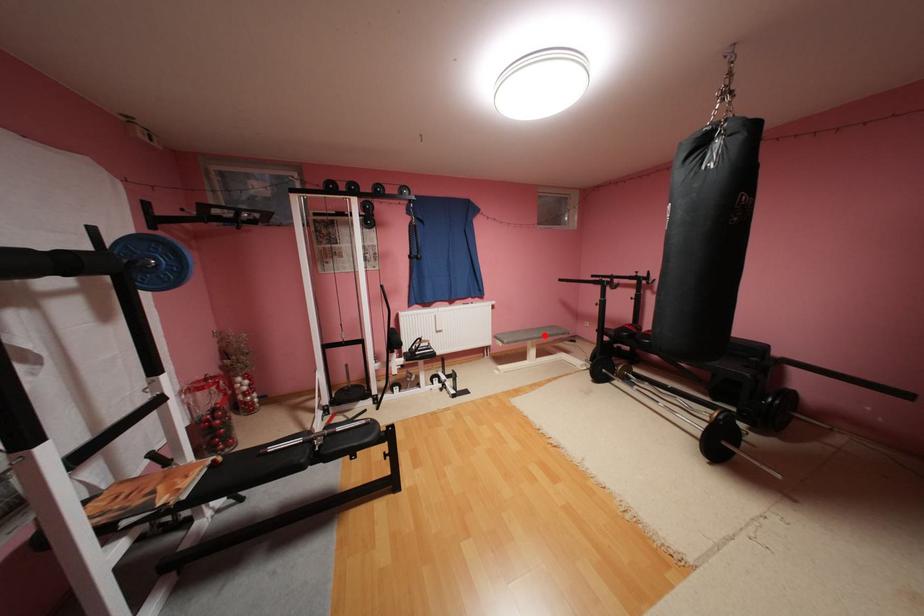
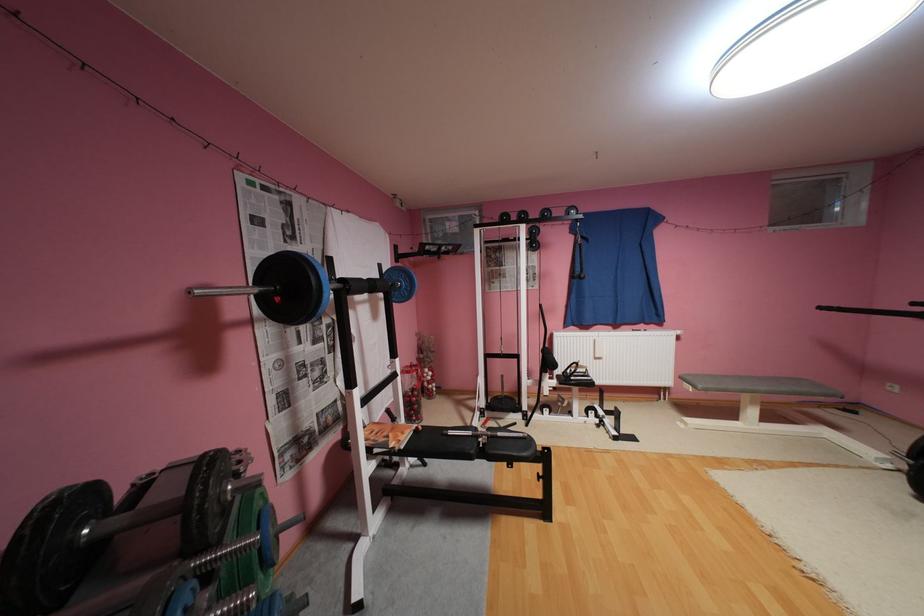
In the second image, find the point that corresponds to the highlighted location in the first image.

(771, 387)